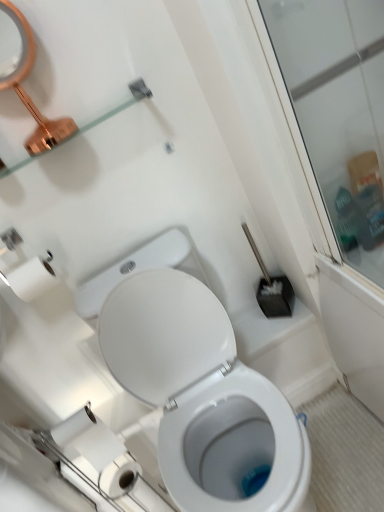
Question: Can you confirm if white glossy bidet at lower center is thinner than clear glass shelf at upper left?

Choices:
 (A) no
 (B) yes

Answer: (B)

Question: Is the position of white glossy bidet at lower center less distant than that of clear glass shelf at upper left?

Choices:
 (A) yes
 (B) no

Answer: (B)

Question: Can we say white glossy bidet at lower center lies outside clear glass shelf at upper left?

Choices:
 (A) no
 (B) yes

Answer: (B)

Question: Is white glossy bidet at lower center turned away from clear glass shelf at upper left?

Choices:
 (A) no
 (B) yes

Answer: (A)

Question: Considering the relative sizes of white glossy bidet at lower center and clear glass shelf at upper left in the image provided, is white glossy bidet at lower center wider than clear glass shelf at upper left?

Choices:
 (A) yes
 (B) no

Answer: (B)

Question: Considering the relative positions of white glossy bidet at lower center and clear glass shelf at upper left in the image provided, is white glossy bidet at lower center to the left or to the right of clear glass shelf at upper left?

Choices:
 (A) left
 (B) right

Answer: (B)

Question: Does point (178, 396) appear closer or farther from the camera than point (140, 96)?

Choices:
 (A) farther
 (B) closer

Answer: (A)

Question: From the image's perspective, relative to clear glass shelf at upper left, is white glossy bidet at lower center above or below?

Choices:
 (A) above
 (B) below

Answer: (B)

Question: Is white glossy bidet at lower center in front of or behind clear glass shelf at upper left in the image?

Choices:
 (A) behind
 (B) front

Answer: (A)

Question: Is clear glass shelf at upper left to the left or to the right of white glossy bidet at lower center in the image?

Choices:
 (A) right
 (B) left

Answer: (B)

Question: Is clear glass shelf at upper left bigger or smaller than white glossy bidet at lower center?

Choices:
 (A) small
 (B) big

Answer: (A)

Question: Is clear glass shelf at upper left in front of or behind white glossy bidet at lower center in the image?

Choices:
 (A) behind
 (B) front

Answer: (B)

Question: In terms of height, does clear glass shelf at upper left look taller or shorter compared to white glossy bidet at lower center?

Choices:
 (A) short
 (B) tall

Answer: (A)

Question: Is white glossy bidet at lower center wider or thinner than copper metallic mirror at upper left?

Choices:
 (A) wide
 (B) thin

Answer: (B)

Question: Is white glossy bidet at lower center taller or shorter than copper metallic mirror at upper left?

Choices:
 (A) short
 (B) tall

Answer: (A)